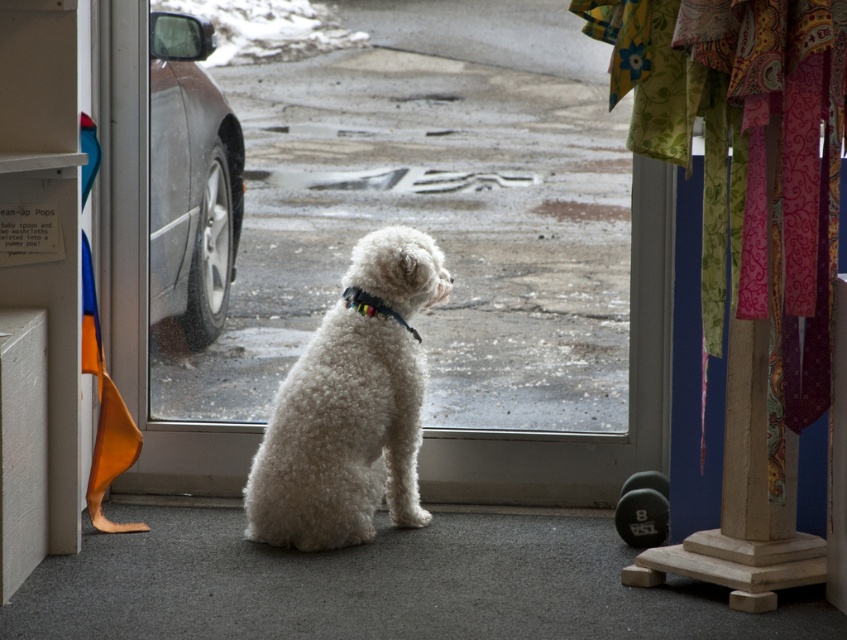
Question: Which of the following is the farthest from the observer?

Choices:
 (A) white fluffy dog at center
 (B) transparent glass door at center

Answer: (B)

Question: Which of the following is the farthest from the observer?

Choices:
 (A) shiny metallic car at left
 (B) transparent glass door at center

Answer: (A)

Question: Is white fluffy dog at center in front of shiny metallic car at left?

Choices:
 (A) yes
 (B) no

Answer: (A)

Question: Does white fluffy dog at center appear on the right side of transparent glass door at center?

Choices:
 (A) yes
 (B) no

Answer: (B)

Question: Among these objects, which one is farthest from the camera?

Choices:
 (A) transparent glass door at center
 (B) shiny metallic car at left
 (C) white fluffy dog at center
 (D) multicolored fabric neckband at center

Answer: (B)

Question: Does white fluffy dog at center appear under transparent glass door at center?

Choices:
 (A) yes
 (B) no

Answer: (A)